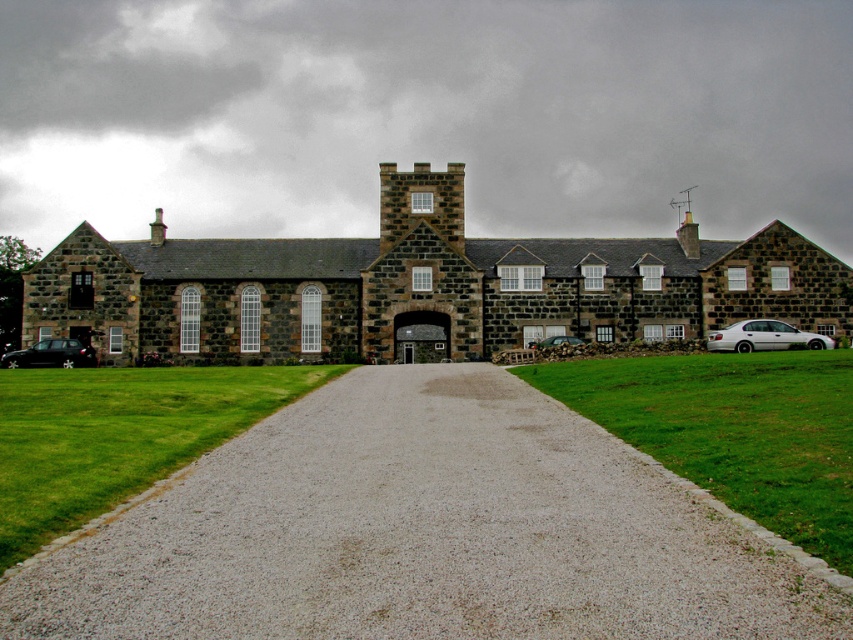
Question: Among these objects, which one is farthest from the camera?

Choices:
 (A) gray gravel at center
 (B) metallic silver car at center
 (C) shiny black car at lower left

Answer: (C)

Question: Among these points, which one is farthest from the camera?

Choices:
 (A) (440, 506)
 (B) (741, 352)
 (C) (73, 340)

Answer: (C)

Question: Which point is farther to the camera?

Choices:
 (A) gray gravel at center
 (B) metallic silver car at center
 (C) shiny black car at lower left
 (D) white metallic sedan at right

Answer: (C)

Question: From the image, what is the correct spatial relationship of white metallic sedan at right in relation to metallic silver car at center?

Choices:
 (A) left
 (B) right

Answer: (B)

Question: Is gray gravel at center behind shiny black car at lower left?

Choices:
 (A) yes
 (B) no

Answer: (B)

Question: Can you confirm if white metallic sedan at right is positioned to the right of metallic silver car at center?

Choices:
 (A) no
 (B) yes

Answer: (B)